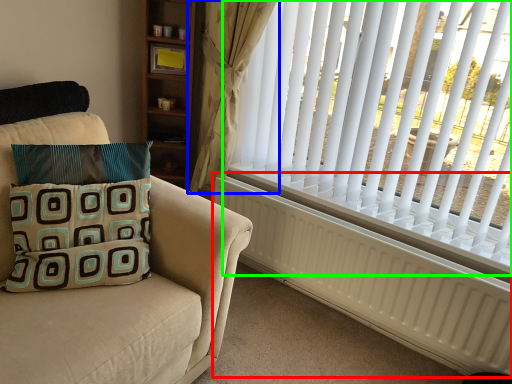
Question: Estimate the real-world distances between objects in this image. Which object is closer to radiator (highlighted by a red box), curtain (highlighted by a blue box) or window blind (highlighted by a green box)?

Choices:
 (A) curtain
 (B) window blind

Answer: (B)